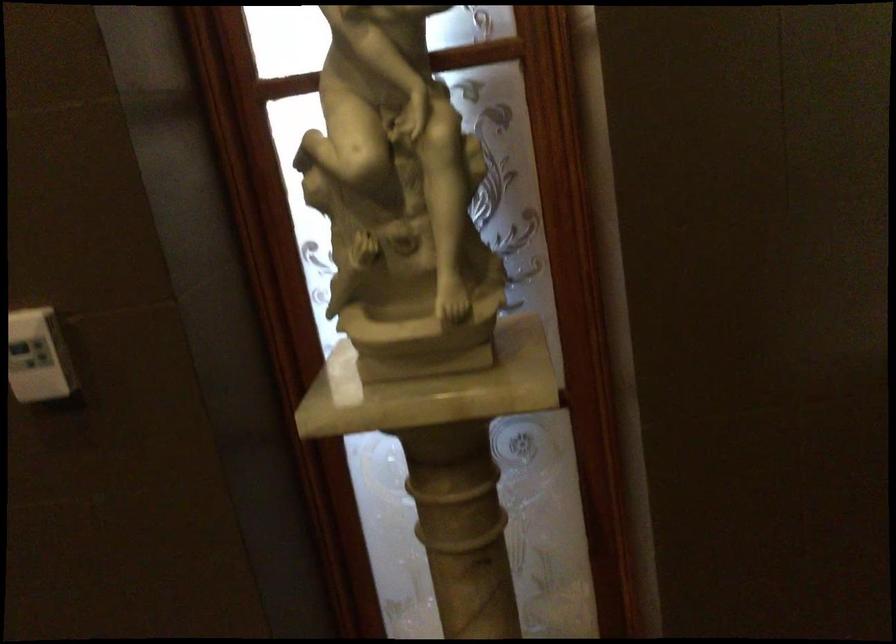
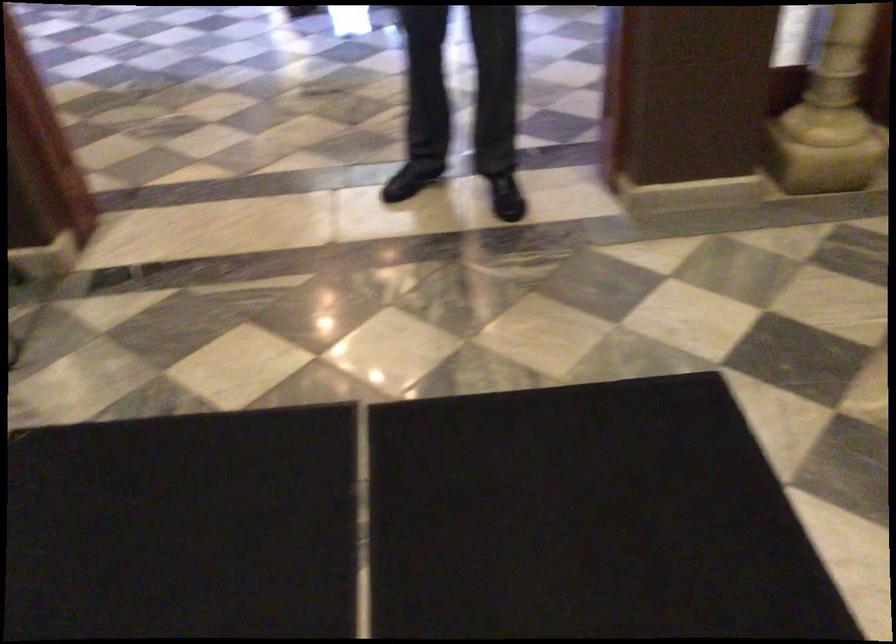
Which direction would the cameraman need to move to produce the second image?

The movement direction of the cameraman is left, backward.